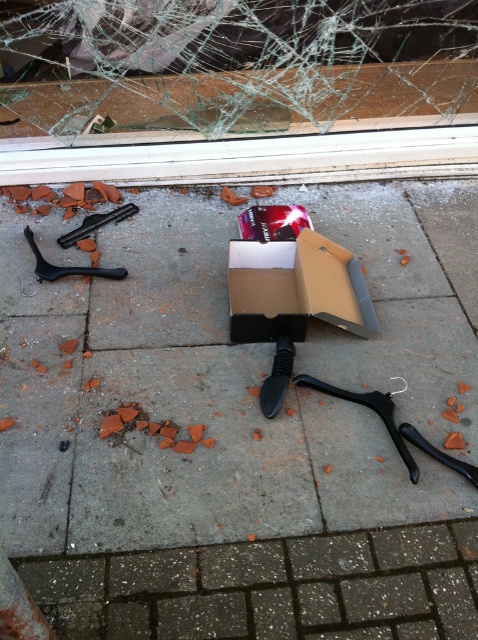
Is point (229, 518) closer to camera compared to point (75, 272)?

That is True.

Consider the image. Does matte cardboard box at center appear on the left side of black plastic hanger at left?

No, matte cardboard box at center is not to the left of black plastic hanger at left.

Locate an element on the screen. matte cardboard box at center is located at coordinates (202, 460).

Between matte cardboard box at center and transparent glass windshield at upper center, which one appears on the right side from the viewer's perspective?

From the viewer's perspective, transparent glass windshield at upper center appears more on the right side.

Between matte cardboard box at center and transparent glass windshield at upper center, which one has more height?

Standing taller between the two is matte cardboard box at center.

Is point (232, 588) closer to camera compared to point (272, 19)?

Yes, it is in front of point (272, 19).

This screenshot has width=478, height=640. I want to click on matte cardboard box at center, so [202, 460].

Does transparent glass windshield at upper center have a lesser height compared to black plastic hanger at left?

Incorrect, transparent glass windshield at upper center's height does not fall short of black plastic hanger at left's.

Is point (441, 72) more distant than point (66, 266)?

Yes.

In order to click on transparent glass windshield at upper center in this screenshot , I will do `click(231, 65)`.